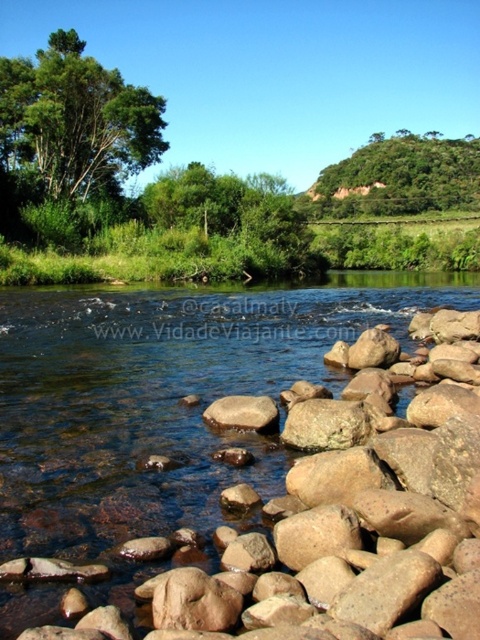
What do you see at coordinates (228, 476) in the screenshot?
I see `brown rough rock at lower center` at bounding box center [228, 476].

Is point (3, 339) less distant than point (470, 145)?

Yes, it is in front of point (470, 145).

Is point (405, 465) less distant than point (452, 152)?

Yes, point (405, 465) is in front of point (452, 152).

Identify the location of brown rough rock at lower center. This screenshot has width=480, height=640. (228, 476).

Is green leafy tree at upper left thinner than green leafy tree at upper center?

Indeed, green leafy tree at upper left has a lesser width compared to green leafy tree at upper center.

What are the coordinates of `green leafy tree at upper left` in the screenshot? It's located at (70, 131).

What do you see at coordinates (70, 131) in the screenshot? This screenshot has height=640, width=480. I see `green leafy tree at upper left` at bounding box center [70, 131].

At what (x,y) coordinates should I click in order to perform the action: click on green leafy tree at upper left. Please return your answer as a coordinate pair (x, y). This screenshot has width=480, height=640. Looking at the image, I should click on (70, 131).

You are a GUI agent. You are given a task and a screenshot of the screen. Output one action in this format:
    pyautogui.click(x=<x>, y=<y>)
    Task: Click on the brown rough rock at lower center
    
    Given the screenshot: What is the action you would take?
    pyautogui.click(x=228, y=476)

Between point (309, 355) and point (274, 426), which one is positioned in front?

Point (274, 426) is more forward.

This screenshot has height=640, width=480. I want to click on brown rough rock at lower center, so click(x=228, y=476).